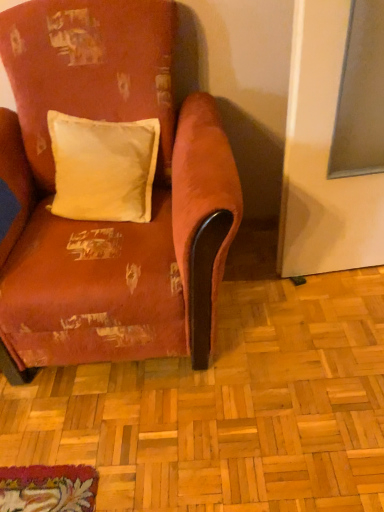
Question: Considering their positions, is white cotton pillow at center located in front of or behind velvet-like red armchair at center?

Choices:
 (A) front
 (B) behind

Answer: (B)

Question: Is white cotton pillow at center taller or shorter than velvet-like red armchair at center?

Choices:
 (A) tall
 (B) short

Answer: (B)

Question: From the image's perspective, is white cotton pillow at center positioned above or below velvet-like red armchair at center?

Choices:
 (A) below
 (B) above

Answer: (B)

Question: Is point (24, 209) closer or farther from the camera than point (109, 138)?

Choices:
 (A) farther
 (B) closer

Answer: (B)

Question: From a real-world perspective, is velvet-like red armchair at center above or below white cotton pillow at center?

Choices:
 (A) below
 (B) above

Answer: (A)

Question: From the image's perspective, is velvet-like red armchair at center located above or below white cotton pillow at center?

Choices:
 (A) below
 (B) above

Answer: (A)

Question: In terms of height, does velvet-like red armchair at center look taller or shorter compared to white cotton pillow at center?

Choices:
 (A) tall
 (B) short

Answer: (A)